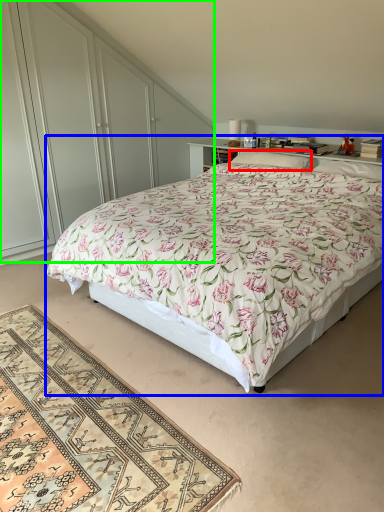
Question: Considering the real-world distances, which object is closest to pillow (highlighted by a red box)? bed (highlighted by a blue box) or dresser (highlighted by a green box).

Choices:
 (A) bed
 (B) dresser

Answer: (A)